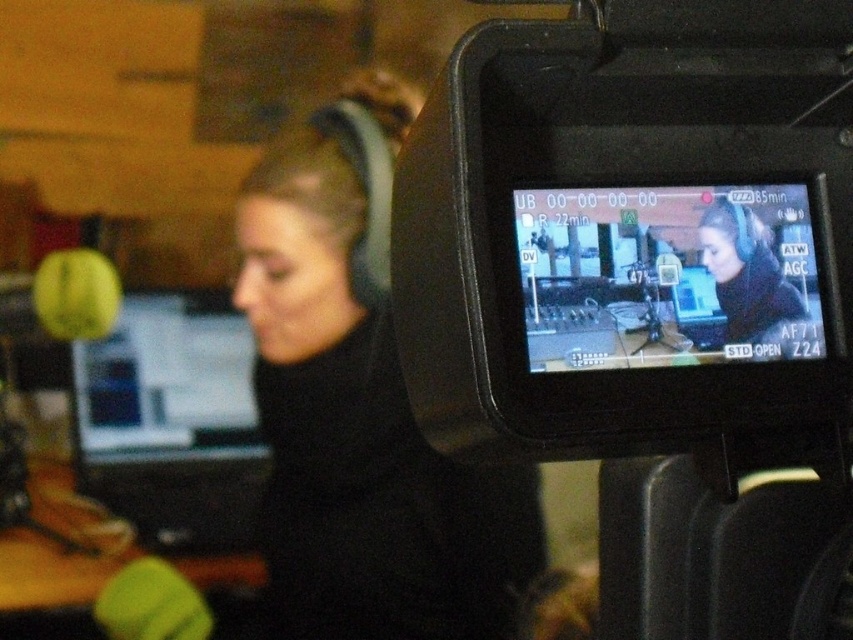
Between matte black monitor at left and matte black headphones at upper center, which one is positioned higher?

matte black headphones at upper center is higher up.

From the picture: Does matte black monitor at left appear on the left side of matte black headphones at upper center?

Correct, you'll find matte black monitor at left to the left of matte black headphones at upper center.

Which is in front, point (112, 372) or point (699, 237)?

Point (699, 237)

Where is `matte black monitor at left`? Image resolution: width=853 pixels, height=640 pixels. matte black monitor at left is located at coordinates (167, 384).

I want to click on black glossy monitor at center, so click(x=666, y=275).

Can you confirm if black glossy monitor at center is taller than matte black headphones at upper center?

Correct, black glossy monitor at center is much taller as matte black headphones at upper center.

At what (x,y) coordinates should I click in order to perform the action: click on black glossy monitor at center. Please return your answer as a coordinate pair (x, y). The image size is (853, 640). Looking at the image, I should click on (666, 275).

I want to click on black glossy monitor at center, so click(666, 275).

This screenshot has width=853, height=640. I want to click on black glossy monitor at center, so click(666, 275).

Is black glossy monitor at center to the right of matte black monitor at left from the viewer's perspective?

Indeed, black glossy monitor at center is positioned on the right side of matte black monitor at left.

What do you see at coordinates (666, 275) in the screenshot? I see `black glossy monitor at center` at bounding box center [666, 275].

Identify the location of black glossy monitor at center. (666, 275).